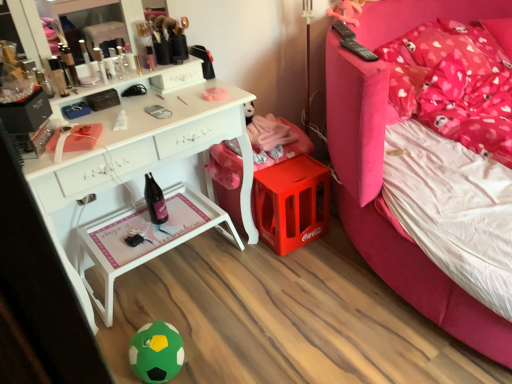
Question: Are white wood tray at lower center and pink fabric bed at upper right beside each other?

Choices:
 (A) no
 (B) yes

Answer: (A)

Question: Is white wood tray at lower center facing away from pink fabric bed at upper right?

Choices:
 (A) no
 (B) yes

Answer: (A)

Question: From a real-world perspective, is white wood tray at lower center physically above pink fabric bed at upper right?

Choices:
 (A) no
 (B) yes

Answer: (A)

Question: Considering the relative sizes of white wood tray at lower center and pink fabric bed at upper right in the image provided, is white wood tray at lower center thinner than pink fabric bed at upper right?

Choices:
 (A) no
 (B) yes

Answer: (B)

Question: From the image's perspective, does white wood tray at lower center appear higher than pink fabric bed at upper right?

Choices:
 (A) no
 (B) yes

Answer: (A)

Question: From a real-world perspective, relative to white wood tray at lower center, is matte black compact at upper left vertically above or below?

Choices:
 (A) below
 (B) above

Answer: (B)

Question: Is matte black compact at upper left in front of or behind white wood tray at lower center in the image?

Choices:
 (A) behind
 (B) front

Answer: (B)

Question: In the image, is matte black compact at upper left on the left side or the right side of white wood tray at lower center?

Choices:
 (A) right
 (B) left

Answer: (B)

Question: In terms of width, does matte black compact at upper left look wider or thinner when compared to white wood tray at lower center?

Choices:
 (A) thin
 (B) wide

Answer: (A)

Question: Is pink fabric bed at upper right inside or outside of matte black compact at upper left?

Choices:
 (A) outside
 (B) inside

Answer: (A)

Question: Is pink fabric bed at upper right wider or thinner than matte black compact at upper left?

Choices:
 (A) wide
 (B) thin

Answer: (A)

Question: From a real-world perspective, relative to matte black compact at upper left, is pink fabric bed at upper right vertically above or below?

Choices:
 (A) below
 (B) above

Answer: (A)

Question: Is point (408, 258) closer or farther from the camera than point (65, 94)?

Choices:
 (A) closer
 (B) farther

Answer: (B)

Question: From the image's perspective, relative to green felt ball at lower center, is white wood tray at lower center above or below?

Choices:
 (A) below
 (B) above

Answer: (B)

Question: Visually, is white wood tray at lower center positioned to the left or to the right of green felt ball at lower center?

Choices:
 (A) right
 (B) left

Answer: (B)